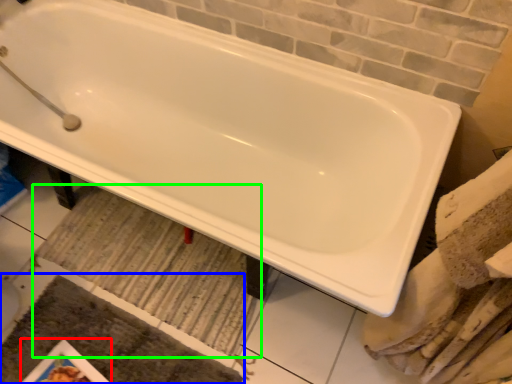
Question: Estimate the real-world distances between objects in this image. Which object is closer to magazine (highlighted by a red box), bath mat (highlighted by a blue box) or bath mat (highlighted by a green box)?

Choices:
 (A) bath mat
 (B) bath mat

Answer: (A)